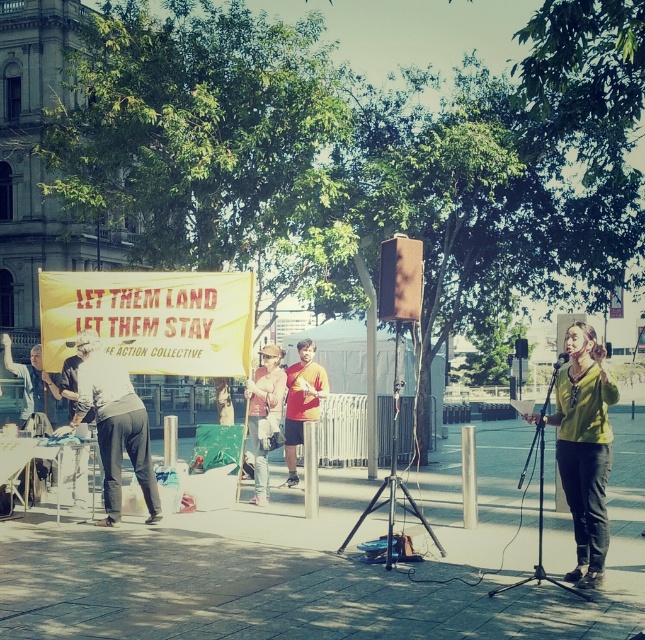
Which of these two, green matte shirt at center or denim jacket at center, stands taller?

green matte shirt at center

Measure the distance between green matte shirt at center and camera.

The distance of green matte shirt at center from camera is 8.30 meters.

Who is more distant from viewer, [570,387] or [263,496]?

Point [263,496]

Identify the location of green matte shirt at center. This screenshot has height=640, width=645. (582, 448).

Can you confirm if matte black pants at center is smaller than denim jacket at center?

Incorrect, matte black pants at center is not smaller in size than denim jacket at center.

Can you confirm if matte black pants at center is wider than denim jacket at center?

Yes, matte black pants at center is wider than denim jacket at center.

Who is more forward, [114,497] or [279,392]?

Point [114,497]

In order to click on matte black pants at center in this screenshot , I will do `click(114, 426)`.

Is green matte shirt at center wider than orange cotton shirt at center?

Correct, the width of green matte shirt at center exceeds that of orange cotton shirt at center.

Is point (600, 369) positioned behind point (299, 388)?

No, it is in front of (299, 388).

You are a GUI agent. You are given a task and a screenshot of the screen. Output one action in this format:
    pyautogui.click(x=<x>, y=<y>)
    Task: Click on the green matte shirt at center
    Image resolution: width=645 pixels, height=640 pixels.
    Given the screenshot: What is the action you would take?
    pyautogui.click(x=582, y=448)